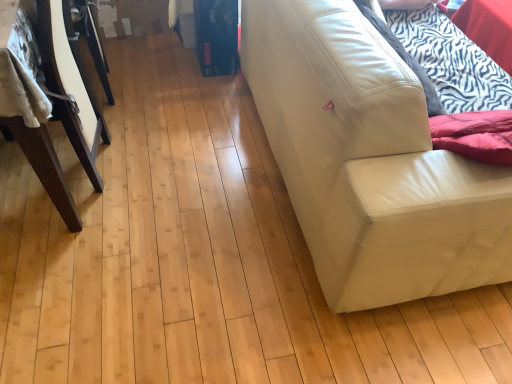
Where is `blank space to the left of white leather couch at right`? The height and width of the screenshot is (384, 512). blank space to the left of white leather couch at right is located at coordinates (181, 187).